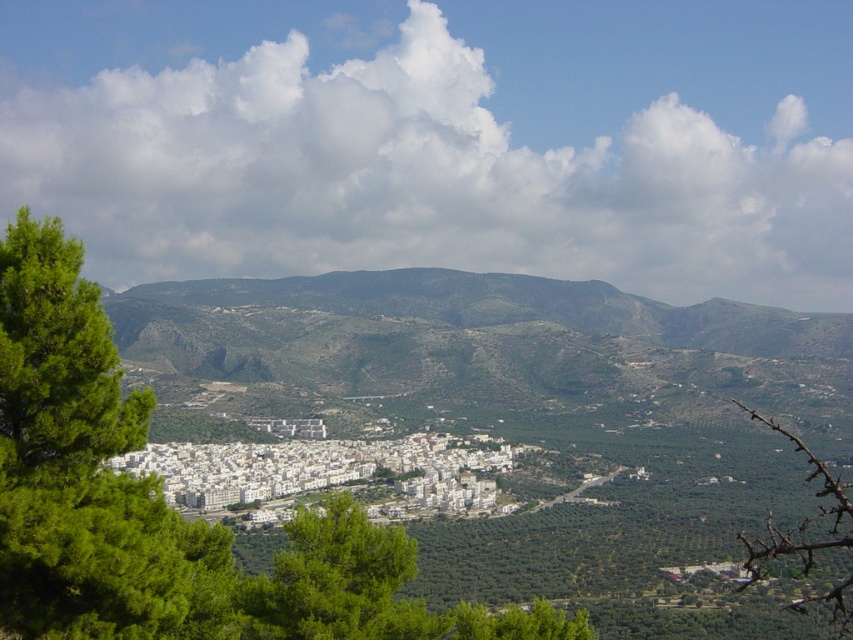
Question: Is green leafy tree at center-left above green spiny branch at lower right?

Choices:
 (A) yes
 (B) no

Answer: (A)

Question: Does green leafy tree at center-left lie behind green spiny branch at lower right?

Choices:
 (A) yes
 (B) no

Answer: (A)

Question: Does green leafy tree at center-left have a smaller size compared to green spiny branch at lower right?

Choices:
 (A) yes
 (B) no

Answer: (A)

Question: Which point is farther to the camera?

Choices:
 (A) (83, 305)
 (B) (766, 534)

Answer: (B)